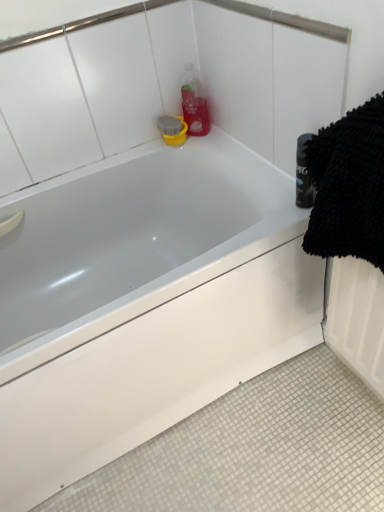
Question: Is white glossy bathtub at upper center shorter than translucent plastic bottle at upper center?

Choices:
 (A) no
 (B) yes

Answer: (A)

Question: Does white glossy bathtub at upper center come in front of translucent plastic bottle at upper center?

Choices:
 (A) no
 (B) yes

Answer: (B)

Question: Is white glossy bathtub at upper center looking in the opposite direction of translucent plastic bottle at upper center?

Choices:
 (A) no
 (B) yes

Answer: (A)

Question: Does white glossy bathtub at upper center turn towards translucent plastic bottle at upper center?

Choices:
 (A) yes
 (B) no

Answer: (B)

Question: Considering the relative positions of white glossy bathtub at upper center and translucent plastic bottle at upper center in the image provided, is white glossy bathtub at upper center to the right of translucent plastic bottle at upper center from the viewer's perspective?

Choices:
 (A) yes
 (B) no

Answer: (B)

Question: Does white glossy bathtub at upper center come behind translucent plastic bottle at upper center?

Choices:
 (A) yes
 (B) no

Answer: (B)

Question: Does white glossy bathtub at upper center have a larger size compared to black microfiber towel at right?

Choices:
 (A) yes
 (B) no

Answer: (A)

Question: Is white glossy bathtub at upper center positioned with its back to black microfiber towel at right?

Choices:
 (A) no
 (B) yes

Answer: (A)

Question: Is white glossy bathtub at upper center facing towards black microfiber towel at right?

Choices:
 (A) yes
 (B) no

Answer: (A)

Question: Is white glossy bathtub at upper center behind black microfiber towel at right?

Choices:
 (A) yes
 (B) no

Answer: (A)

Question: Is white glossy bathtub at upper center directly adjacent to black microfiber towel at right?

Choices:
 (A) no
 (B) yes

Answer: (A)

Question: Is there a large distance between white glossy bathtub at upper center and black microfiber towel at right?

Choices:
 (A) no
 (B) yes

Answer: (A)

Question: Is black microfiber towel at right next to white glossy bathtub at upper center and touching it?

Choices:
 (A) no
 (B) yes

Answer: (A)